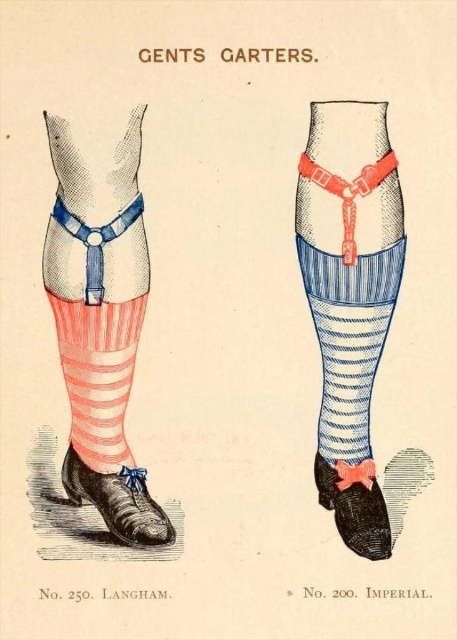
Who is more forward, (110, 410) or (128, 330)?

Positioned in front is point (128, 330).

Is matte blue garter at left taller than striped cotton sock at lower left?

Yes.

At what (x,y) coordinates should I click in order to perform the action: click on matte blue garter at left. Please return your answer as a coordinate pair (x, y). This screenshot has width=457, height=640. Looking at the image, I should click on (100, 332).

Measure the distance between pink satin shoe at lower left and camera.

pink satin shoe at lower left and camera are 4.75 feet apart.

Can you confirm if pink satin shoe at lower left is positioned to the right of black suede shoe at lower right?

No, pink satin shoe at lower left is not to the right of black suede shoe at lower right.

The image size is (457, 640). Identify the location of pink satin shoe at lower left. (118, 500).

The width and height of the screenshot is (457, 640). What are the coordinates of `pink satin shoe at lower left` in the screenshot? It's located at (118, 500).

Is striped cotton sock at lower left to the right of black suede shoe at lower right from the viewer's perspective?

In fact, striped cotton sock at lower left is to the left of black suede shoe at lower right.

Who is taller, striped cotton sock at lower left or black suede shoe at lower right?

striped cotton sock at lower left is taller.

Is point (79, 397) closer to viewer compared to point (324, 490)?

That is True.

At what (x,y) coordinates should I click in order to perform the action: click on striped cotton sock at lower left. Please return your answer as a coordinate pair (x, y). This screenshot has width=457, height=640. Looking at the image, I should click on (99, 374).